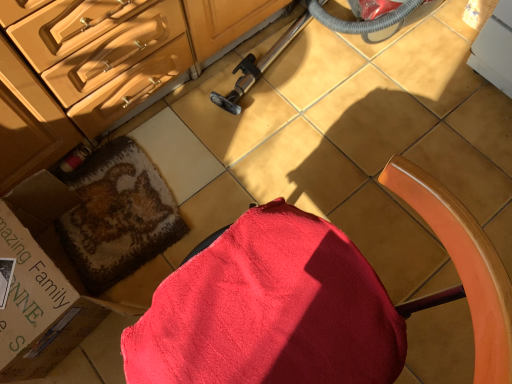
The height and width of the screenshot is (384, 512). I want to click on red cotton bath towel at lower left, so click(x=117, y=214).

This screenshot has height=384, width=512. I want to click on cardboard box at lower left, so (92, 238).

Considering the relative positions of matte wood cabinetry at upper left and red fabric chair at center in the image provided, is matte wood cabinetry at upper left to the left or to the right of red fabric chair at center?

From the image, it's evident that matte wood cabinetry at upper left is to the left of red fabric chair at center.

Where is `cabinetry behind the red fabric chair at center`? Image resolution: width=512 pixels, height=384 pixels. cabinetry behind the red fabric chair at center is located at coordinates (81, 71).

Considering the sizes of objects matte wood cabinetry at upper left and red fabric chair at center in the image provided, who is thinner, matte wood cabinetry at upper left or red fabric chair at center?

red fabric chair at center.

Is point (87, 168) in front of point (20, 354)?

No, (87, 168) is further to viewer.

Looking at this image, from the image's perspective, between red cotton bath towel at lower left and cardboard box at lower left, which one is located above?

red cotton bath towel at lower left appears higher in the image.

From a real-world perspective, which object stands above the other?

cardboard box at lower left.

Between red cotton bath towel at lower left and cardboard box at lower left, which one has larger size?

With larger size is cardboard box at lower left.

Is the position of matte wood cabinetry at upper left less distant than that of cardboard box at lower left?

Yes.

How different are the orientations of matte wood cabinetry at upper left and cardboard box at lower left in degrees?

The angular difference between matte wood cabinetry at upper left and cardboard box at lower left is 93 degrees.

From a real-world perspective, which is physically above, matte wood cabinetry at upper left or cardboard box at lower left?

matte wood cabinetry at upper left.

Which is behind, point (11, 135) or point (97, 245)?

The point (97, 245) is more distant.

In the image, is matte wood cabinetry at upper left positioned in front of or behind red cotton bath towel at lower left?

Clearly, matte wood cabinetry at upper left is in front of red cotton bath towel at lower left.

Is matte wood cabinetry at upper left positioned with its back to red cotton bath towel at lower left?

No, matte wood cabinetry at upper left's orientation is not away from red cotton bath towel at lower left.

From a real-world perspective, which is physically below, matte wood cabinetry at upper left or red cotton bath towel at lower left?

In real-world perspective, red cotton bath towel at lower left is lower.

From the picture: Measure the distance from red cotton bath towel at lower left to red fabric chair at center.

The distance of red cotton bath towel at lower left from red fabric chair at center is 22.90 inches.

Between red cotton bath towel at lower left and red fabric chair at center, which one appears on the left side from the viewer's perspective?

red cotton bath towel at lower left.

From the image's perspective, does red cotton bath towel at lower left appear higher than red fabric chair at center?

Indeed, from the image's perspective, red cotton bath towel at lower left is shown above red fabric chair at center.

From a real-world perspective, between red cotton bath towel at lower left and red fabric chair at center, who is vertically higher?

red fabric chair at center.

Would you say cardboard box at lower left is part of red fabric chair at center's contents?

Definitely not — cardboard box at lower left is not inside red fabric chair at center.

Is red fabric chair at center positioned with its back to cardboard box at lower left?

No, cardboard box at lower left is not at the back of red fabric chair at center.

Based on the photo, from a real-world perspective, does red fabric chair at center stand above cardboard box at lower left?

Correct, in the physical world, red fabric chair at center is higher than cardboard box at lower left.

Relative to matte wood cabinetry at upper left, is cardboard box at lower left in front or behind?

cardboard box at lower left is behind matte wood cabinetry at upper left.

Which is less distant, (85, 320) or (83, 122)?

Point (85, 320) is positioned closer to the camera compared to point (83, 122).

The image size is (512, 384). Find the location of `box located below the matte wood cabinetry at upper left (from the image's perspective)`. box located below the matte wood cabinetry at upper left (from the image's perspective) is located at coordinates (92, 238).

Does cardboard box at lower left have a lesser width compared to matte wood cabinetry at upper left?

Yes, cardboard box at lower left is thinner than matte wood cabinetry at upper left.

The width and height of the screenshot is (512, 384). I want to click on chair to the right of matte wood cabinetry at upper left, so click(269, 310).

Locate an element on the screen. This screenshot has height=384, width=512. bath towel that is above the cardboard box at lower left (from the image's perspective) is located at coordinates (117, 214).

Looking at the image, which one is located further to red fabric chair at center, cardboard box at lower left or red cotton bath towel at lower left?

Based on the image, red cotton bath towel at lower left appears to be further to red fabric chair at center.

When comparing their distances from cardboard box at lower left, does matte wood cabinetry at upper left or red cotton bath towel at lower left seem closer?

red cotton bath towel at lower left lies closer to cardboard box at lower left than the other object.

Which object lies nearer to the anchor point matte wood cabinetry at upper left, red fabric chair at center or red cotton bath towel at lower left?

Among the two, red cotton bath towel at lower left is located nearer to matte wood cabinetry at upper left.

Looking at the image, which one is located closer to red cotton bath towel at lower left, red fabric chair at center or matte wood cabinetry at upper left?

The object closer to red cotton bath towel at lower left is matte wood cabinetry at upper left.

Based on their spatial positions, is cardboard box at lower left or red cotton bath towel at lower left further from matte wood cabinetry at upper left?

red cotton bath towel at lower left.

Based on their spatial positions, is matte wood cabinetry at upper left or cardboard box at lower left closer to red cotton bath towel at lower left?

The object closer to red cotton bath towel at lower left is cardboard box at lower left.

Which object lies nearer to the anchor point cardboard box at lower left, red fabric chair at center or red cotton bath towel at lower left?

red cotton bath towel at lower left lies closer to cardboard box at lower left than the other object.

Estimate the real-world distances between objects in this image. Which object is closer to cardboard box at lower left, matte wood cabinetry at upper left or red fabric chair at center?

matte wood cabinetry at upper left is closer to cardboard box at lower left.

Where is `box between red fabric chair at center and red cotton bath towel at lower left in the front-back direction`? box between red fabric chair at center and red cotton bath towel at lower left in the front-back direction is located at coordinates (92, 238).

Locate an element on the screen. The width and height of the screenshot is (512, 384). bath towel that lies between matte wood cabinetry at upper left and cardboard box at lower left from top to bottom is located at coordinates (117, 214).

Where is `cabinetry located between red fabric chair at center and red cotton bath towel at lower left in the depth direction`? cabinetry located between red fabric chair at center and red cotton bath towel at lower left in the depth direction is located at coordinates (81, 71).

This screenshot has width=512, height=384. In order to click on box between matte wood cabinetry at upper left and red fabric chair at center from top to bottom in this screenshot , I will do `click(92, 238)`.